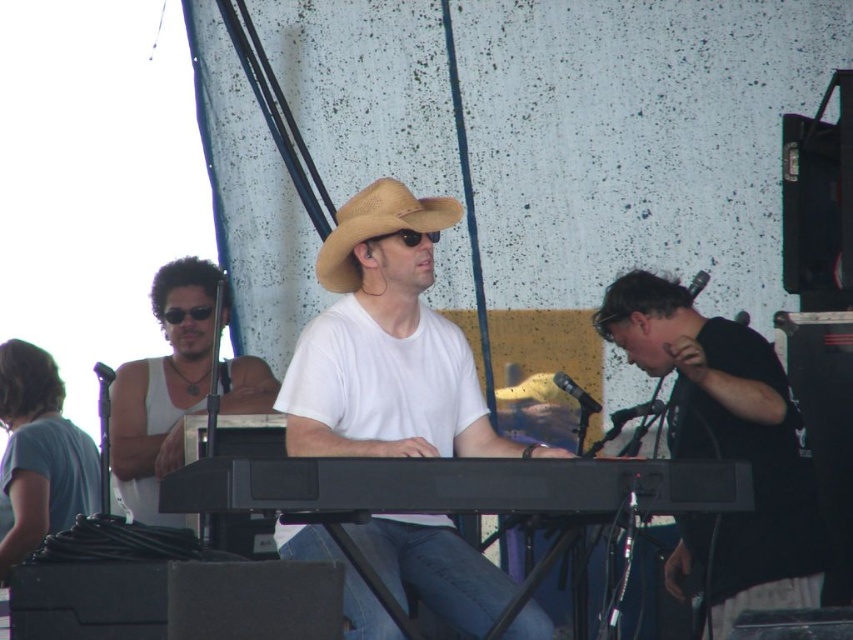
Question: Can you confirm if white matte shirt at center is bigger than black matte shirt at center?

Choices:
 (A) no
 (B) yes

Answer: (B)

Question: Is white matte shirt at center positioned before black plastic keyboard at center?

Choices:
 (A) yes
 (B) no

Answer: (B)

Question: Which object is positioned farthest from the white tank top at left?

Choices:
 (A) tan straw hat at center
 (B) white matte shirt at center
 (C) black plastic keyboard at center
 (D) black matte shirt at center

Answer: (C)

Question: Is black matte shirt at center thinner than black plastic keyboard at center?

Choices:
 (A) no
 (B) yes

Answer: (B)

Question: Which point is farther to the camera?

Choices:
 (A) (399, 593)
 (B) (189, 358)
 (C) (351, 211)

Answer: (B)

Question: Among these points, which one is farthest from the camera?

Choices:
 (A) (128, 515)
 (B) (450, 582)

Answer: (A)